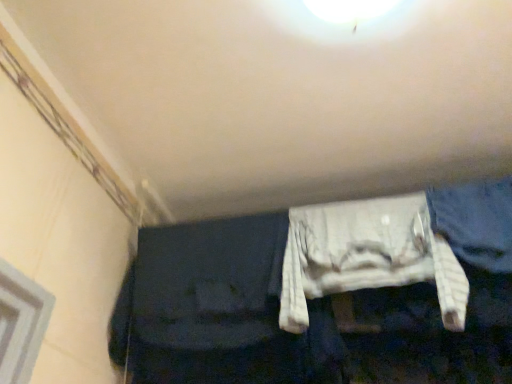
What do you see at coordinates (367, 256) in the screenshot?
I see `white fabric cushion at center` at bounding box center [367, 256].

Find the location of a particular element. The width and height of the screenshot is (512, 384). white fabric cushion at center is located at coordinates (367, 256).

Describe the element at coordinates (476, 222) in the screenshot. I see `denim at right` at that location.

At what (x,y) coordinates should I click in order to perform the action: click on denim at right. Please return your answer as a coordinate pair (x, y). The image size is (512, 384). Looking at the image, I should click on (476, 222).

At what (x,y) coordinates should I click in order to perform the action: click on white fabric cushion at center. Please return your answer as a coordinate pair (x, y). This screenshot has height=384, width=512. Looking at the image, I should click on coord(367,256).

Does white fabric cushion at center appear on the left side of denim at right?

Correct, you'll find white fabric cushion at center to the left of denim at right.

Which object is further away from the camera taking this photo, white fabric cushion at center or denim at right?

denim at right is more distant.

Which is behind, point (298, 225) or point (478, 220)?

Point (298, 225)

From the image's perspective, which one is positioned lower, white fabric cushion at center or denim at right?

From the image's view, white fabric cushion at center is below.

Consider the image. From a real-world perspective, is white fabric cushion at center physically above denim at right?

Incorrect, from a real-world perspective, white fabric cushion at center is lower than denim at right.

Which object is wider, white fabric cushion at center or denim at right?

white fabric cushion at center.

Which of these two, white fabric cushion at center or denim at right, stands taller?

white fabric cushion at center is taller.

Which of these two, white fabric cushion at center or denim at right, is bigger?

Bigger between the two is white fabric cushion at center.

Is white fabric cushion at center surrounding denim at right?

That's incorrect, denim at right is not inside white fabric cushion at center.

From the picture: Does white fabric cushion at center touch denim at right?

No, white fabric cushion at center is not with denim at right.

Is white fabric cushion at center aimed at denim at right?

No, white fabric cushion at center is not turned towards denim at right.

What's the angular difference between white fabric cushion at center and denim at right's facing directions?

white fabric cushion at center and denim at right are facing 0.000771 degrees away from each other.

Image resolution: width=512 pixels, height=384 pixels. Find the location of `clothing in front of the denim at right`. clothing in front of the denim at right is located at coordinates (367, 256).

Based on their positions, is denim at right located to the left or right of white fabric cushion at center?

Clearly, denim at right is on the right of white fabric cushion at center in the image.

Does denim at right lie in front of white fabric cushion at center?

No, denim at right is further to the viewer.

Is point (452, 214) positioned behind point (407, 282)?

Yes, it is.

From the image's perspective, is denim at right located above or below white fabric cushion at center?

From the image's perspective, denim at right appears above white fabric cushion at center.

From a real-world perspective, who is located higher, denim at right or white fabric cushion at center?

denim at right, from a real-world perspective.

Considering the sizes of objects denim at right and white fabric cushion at center in the image provided, who is wider, denim at right or white fabric cushion at center?

white fabric cushion at center is wider.

Considering the sizes of objects denim at right and white fabric cushion at center in the image provided, who is shorter, denim at right or white fabric cushion at center?

With less height is denim at right.

Who is bigger, denim at right or white fabric cushion at center?

With larger size is white fabric cushion at center.

Is denim at right spatially inside white fabric cushion at center, or outside of it?

The correct answer is: outside.

Would you say denim at right is a long distance from white fabric cushion at center?

No, denim at right is in close proximity to white fabric cushion at center.

Is denim at right aimed at white fabric cushion at center?

No, denim at right is not aimed at white fabric cushion at center.

Looking at this image, how many degrees apart are the facing directions of denim at right and white fabric cushion at center?

The facing directions of denim at right and white fabric cushion at center are 0.000771 degrees apart.

At what (x,y) coordinates should I click in order to perform the action: click on jeans lying on the right of white fabric cushion at center. Please return your answer as a coordinate pair (x, y). The image size is (512, 384). Looking at the image, I should click on (476, 222).

The height and width of the screenshot is (384, 512). I want to click on jeans lying above the white fabric cushion at center (from the image's perspective), so click(476, 222).

Locate an element on the screen. The height and width of the screenshot is (384, 512). clothing on the left of denim at right is located at coordinates (367, 256).